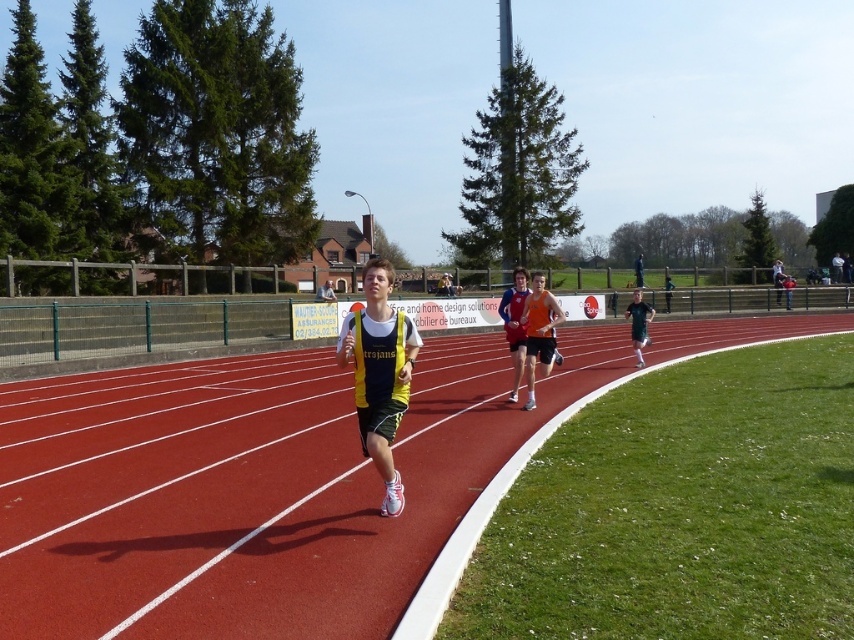
Question: Which point is closer to the camera taking this photo?

Choices:
 (A) (624, 317)
 (B) (232, 550)
 (C) (407, 385)
 (D) (506, 301)

Answer: (B)

Question: Among these objects, which one is nearest to the camera?

Choices:
 (A) red rubber track at center
 (B) black athletic shorts at right

Answer: (A)

Question: Can you confirm if red rubber track at center is positioned to the right of black athletic shorts at right?

Choices:
 (A) no
 (B) yes

Answer: (A)

Question: In this image, where is orange matte tank top at center located relative to blue jersey at center?

Choices:
 (A) below
 (B) above

Answer: (A)

Question: Which of the following is the farthest from the observer?

Choices:
 (A) black athletic shorts at right
 (B) blue jersey at center

Answer: (A)

Question: Is orange matte tank top at center above black athletic shorts at right?

Choices:
 (A) yes
 (B) no

Answer: (B)